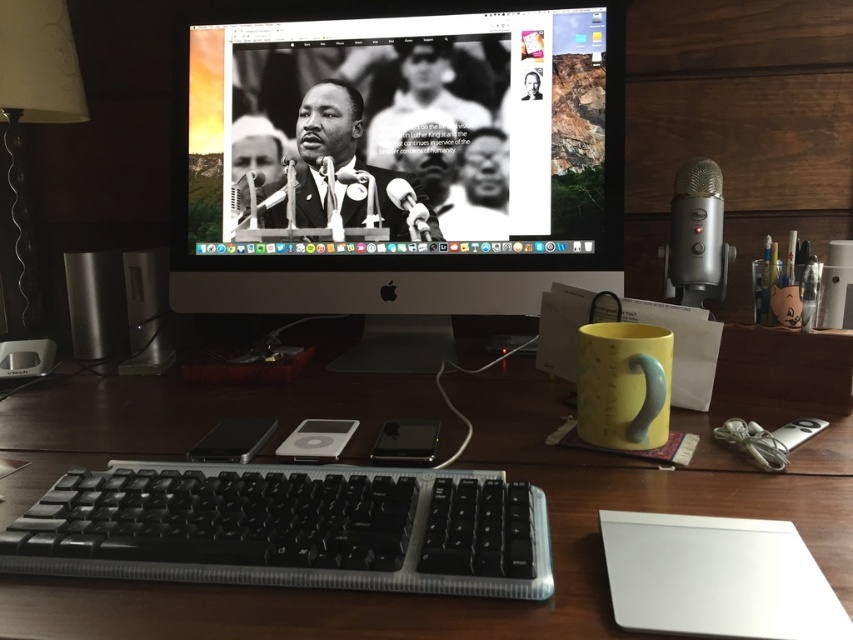
Question: Considering the relative positions of wooden at center and satin black speaker at left in the image provided, where is wooden at center located with respect to satin black speaker at left?

Choices:
 (A) right
 (B) left

Answer: (A)

Question: Does wooden at center lie in front of black plastic keyboard at lower left?

Choices:
 (A) yes
 (B) no

Answer: (A)

Question: From the image, what is the correct spatial relationship of black matte monitor at center in relation to silver metallic speaker at left?

Choices:
 (A) above
 (B) below

Answer: (A)

Question: Which object is farther from the camera taking this photo?

Choices:
 (A) black plastic keyboard at lower left
 (B) matte silver lamp at left
 (C) silver metallic speaker at left

Answer: (C)

Question: Based on their relative distances, which object is nearer to the matte silver lamp at left?

Choices:
 (A) black matte monitor at center
 (B) silver metallic speaker at left

Answer: (B)

Question: Which is farther from the satin black speaker at left?

Choices:
 (A) matte silver lamp at left
 (B) black matte monitor at center
 (C) wooden at center
 (D) silver metallic speaker at left

Answer: (C)